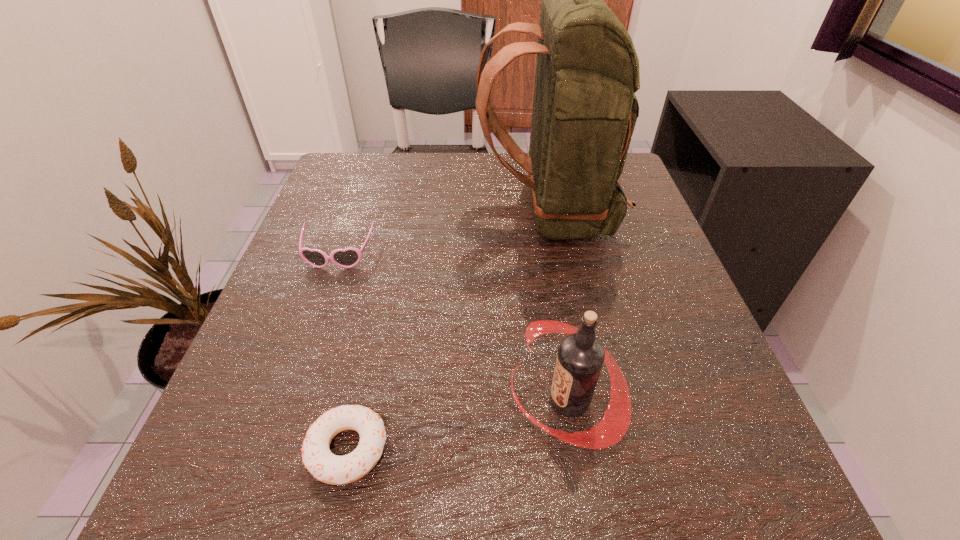
Identify the location of backpack. (584, 113).

Locate an element on the screen. The image size is (960, 540). the second tallest object is located at coordinates (580, 357).

I want to click on the second shortest object, so click(x=347, y=258).

Find the location of a particular element. the shortest object is located at coordinates (326, 467).

Locate an element on the screen. Image resolution: width=960 pixels, height=540 pixels. blank area located on the back of the tallest object is located at coordinates (360, 213).

Locate an element on the screen. Image resolution: width=960 pixels, height=540 pixels. free point located on the back of the tallest object is located at coordinates (383, 213).

The image size is (960, 540). I want to click on free location located 0.050m on the back of the tallest object, so click(453, 213).

What are the coordinates of `free space located on the label of the root beer` in the screenshot? It's located at (447, 401).

I want to click on free space located 0.220m on the label of the root beer, so click(x=355, y=401).

This screenshot has width=960, height=540. Identify the location of free location located 0.340m on the label of the root beer. (270, 401).